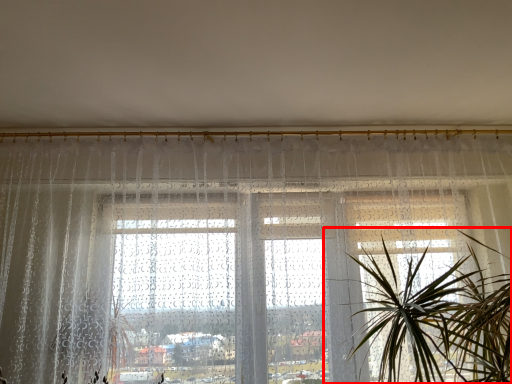
Question: Where is houseplant (annotated by the red box) located in relation to window in the image?

Choices:
 (A) left
 (B) right

Answer: (B)